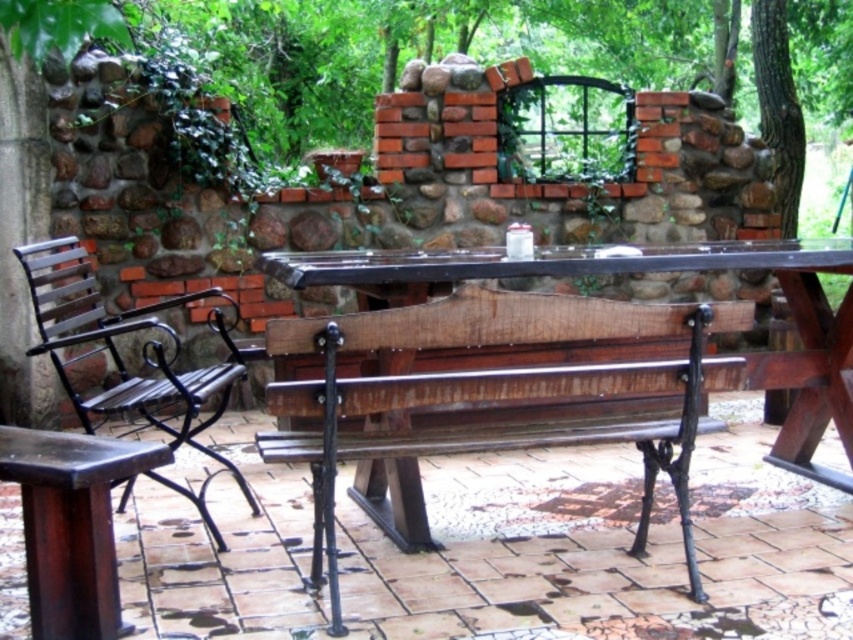
Question: Is black wrought iron chair at left positioned at the back of dark brown wood stool at lower left?

Choices:
 (A) no
 (B) yes

Answer: (B)

Question: Can you confirm if rustic wood bench at center is thinner than black wrought iron chair at left?

Choices:
 (A) yes
 (B) no

Answer: (B)

Question: Which point is farther from the camera taking this photo?

Choices:
 (A) (125, 460)
 (B) (496, 346)

Answer: (B)

Question: Does black wrought iron chair at left have a lesser width compared to dark brown wood stool at lower left?

Choices:
 (A) no
 (B) yes

Answer: (A)

Question: Which object appears closest to the camera in this image?

Choices:
 (A) dark brown wood stool at lower left
 (B) rustic wood bench at center

Answer: (A)

Question: Which is farther from the black wrought iron chair at left?

Choices:
 (A) dark brown wood stool at lower left
 (B) rustic wood bench at center

Answer: (B)